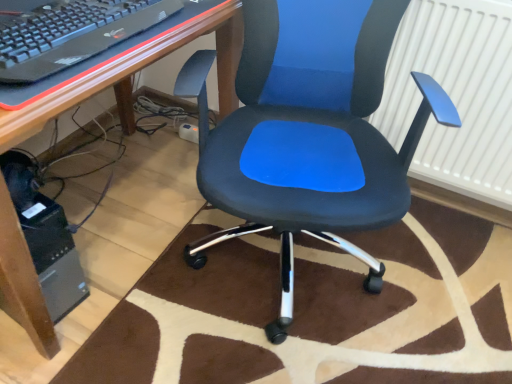
What are the coordinates of `vacant point to the right of matte black office chair at center` in the screenshot? It's located at (441, 286).